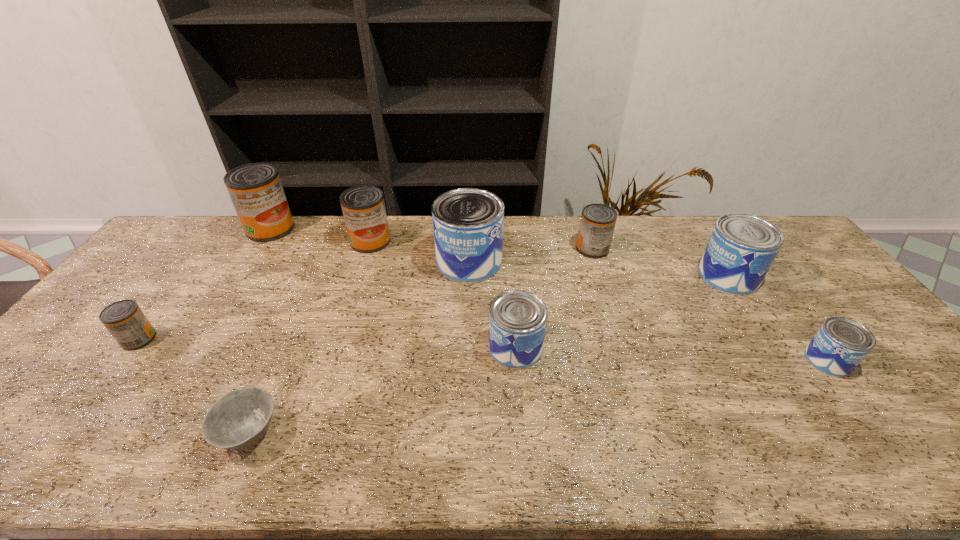
Identify the location of blank space located on the front of the sixth can from left to right. Image resolution: width=960 pixels, height=540 pixels. coord(612,311).

I want to click on vacant space situated 0.120m on the front label of the second smallest blue can, so click(444, 347).

I want to click on vacant space situated 0.390m on the front label of the second smallest blue can, so click(342, 347).

You are a GUI agent. You are given a task and a screenshot of the screen. Output one action in this format:
    pyautogui.click(x=<x>, y=<y>)
    Task: Click on the vacant space situated 0.200m on the front label of the second smallest blue can
    The width and height of the screenshot is (960, 540).
    Given the screenshot: What is the action you would take?
    pyautogui.click(x=413, y=347)

Locate an element on the screen. free spot located 0.230m on the back of the smallest red can is located at coordinates (189, 274).

This screenshot has height=540, width=960. What are the coordinates of `vacant space located on the front label of the smallest blue can` in the screenshot? It's located at (905, 463).

I want to click on vacant space positioned on the back of the nearest object, so click(x=293, y=332).

Locate an element on the screen. The width and height of the screenshot is (960, 540). object situated at the near edge is located at coordinates (239, 419).

At what (x,y) coordinates should I click in order to perform the action: click on object that is positioned at the left edge. Please return your answer as a coordinate pair (x, y). Looking at the image, I should click on (124, 319).

The width and height of the screenshot is (960, 540). Find the location of `object that is at the right edge`. object that is at the right edge is located at coordinates (838, 347).